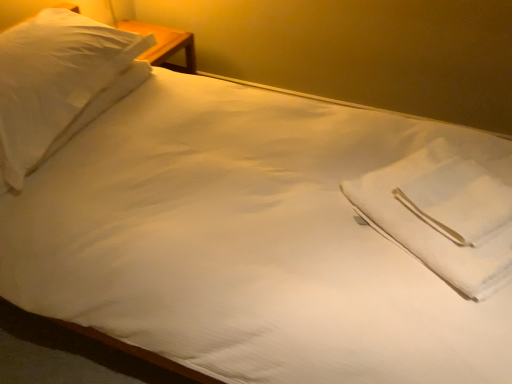
Question: Considering the positions of white soft pillow at upper left and white cotton cloth at center in the image, is white soft pillow at upper left taller or shorter than white cotton cloth at center?

Choices:
 (A) tall
 (B) short

Answer: (A)

Question: Considering the positions of white soft pillow at upper left and white cotton cloth at center in the image, is white soft pillow at upper left wider or thinner than white cotton cloth at center?

Choices:
 (A) thin
 (B) wide

Answer: (B)

Question: Is point (17, 110) positioned closer to the camera than point (477, 201)?

Choices:
 (A) farther
 (B) closer

Answer: (A)

Question: From the image's perspective, is white cotton cloth at center positioned above or below white soft pillow at upper left?

Choices:
 (A) above
 (B) below

Answer: (B)

Question: Visually, is white cotton cloth at center positioned to the left or to the right of white soft pillow at upper left?

Choices:
 (A) left
 (B) right

Answer: (B)

Question: Considering the positions of point (457, 253) and point (83, 87), is point (457, 253) closer or farther from the camera than point (83, 87)?

Choices:
 (A) farther
 (B) closer

Answer: (B)

Question: In terms of height, does white cotton cloth at center look taller or shorter compared to white soft pillow at upper left?

Choices:
 (A) short
 (B) tall

Answer: (A)